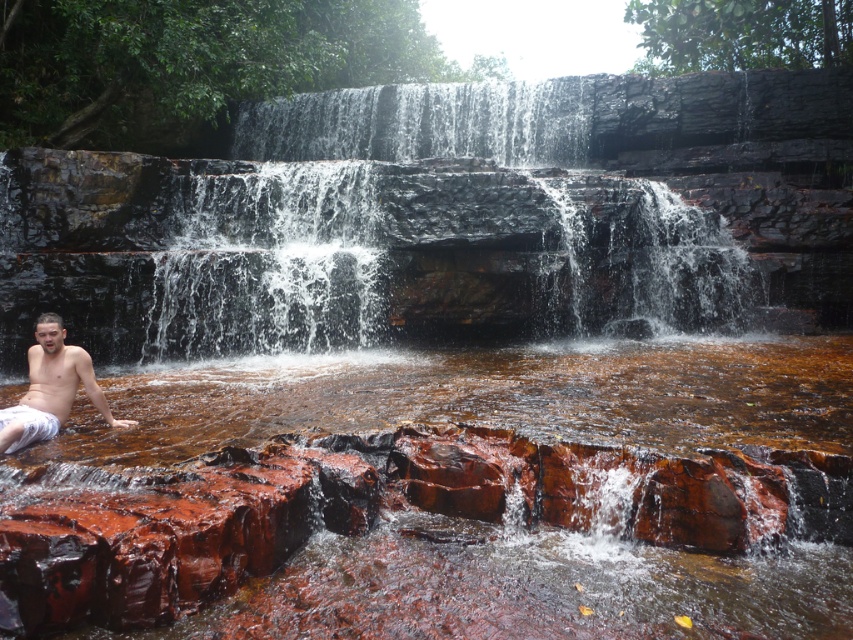
Question: Is black stone waterfall at center below shiny white shorts at lower left?

Choices:
 (A) no
 (B) yes

Answer: (A)

Question: Where is brown glossy water at center located in relation to shiny white shorts at lower left in the image?

Choices:
 (A) below
 (B) above

Answer: (A)

Question: Which point appears farthest from the camera in this image?

Choices:
 (A) (202, 234)
 (B) (289, 618)
 (C) (55, 314)

Answer: (A)

Question: From the image, what is the correct spatial relationship of brown glossy water at center in relation to black stone waterfall at center?

Choices:
 (A) below
 (B) above

Answer: (A)

Question: Among these points, which one is farthest from the camera?

Choices:
 (A) (630, 378)
 (B) (94, 396)
 (C) (672, 307)

Answer: (C)

Question: Which is nearer to the black stone waterfall at center?

Choices:
 (A) shiny white shorts at lower left
 (B) brown glossy water at center

Answer: (B)